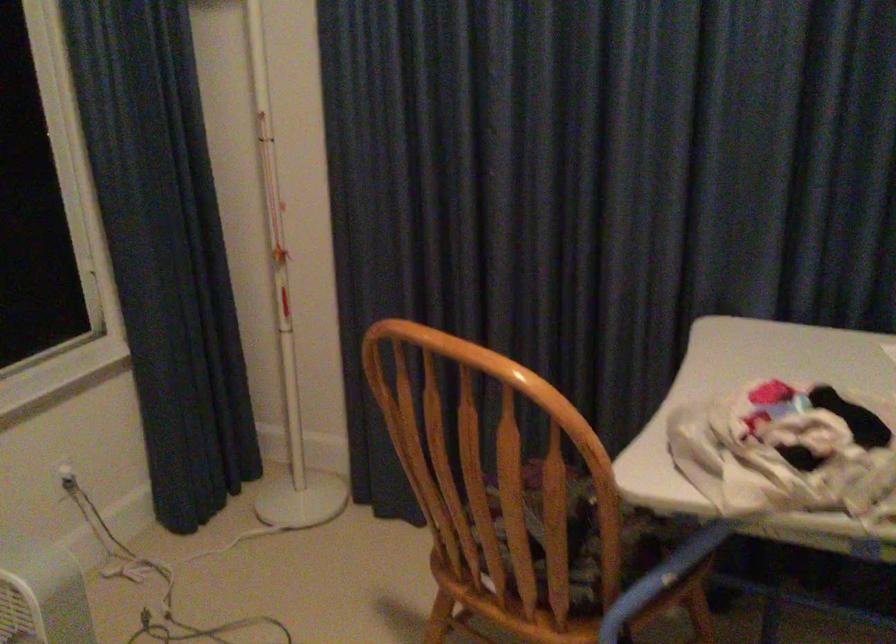
This screenshot has width=896, height=644. Describe the element at coordinates (66, 230) in the screenshot. I see `a white window latch` at that location.